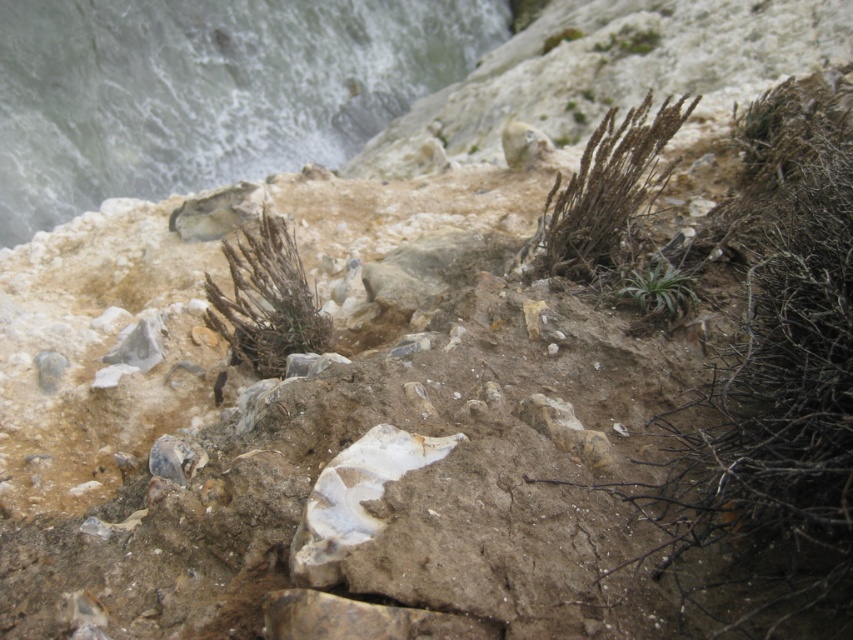
You are a geologist examining the landscape. You need to collect samples from both the brown dry grass at upper center and the brown textured plant at center. Which sample should you collect first if you want to start with the one that is nearest to you?

You should collect the brown dry grass at upper center first because it is closer to the viewer than the brown textured plant at center.